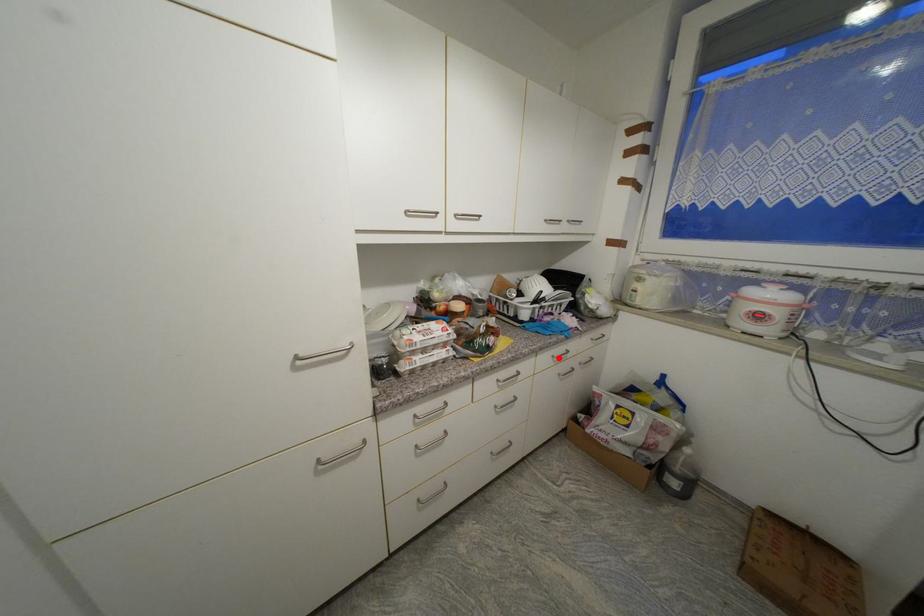
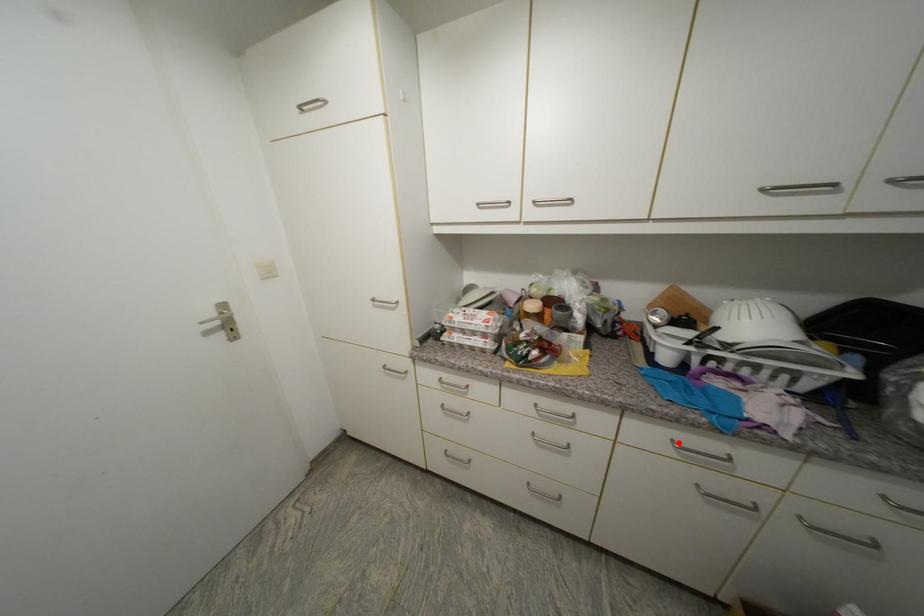
I am providing you with two images of the same scene from different viewpoints. A red point is marked on the first image and another point is marked on the second image. Do the highlighted points in image1 and image2 indicate the same real-world spot?

Yes